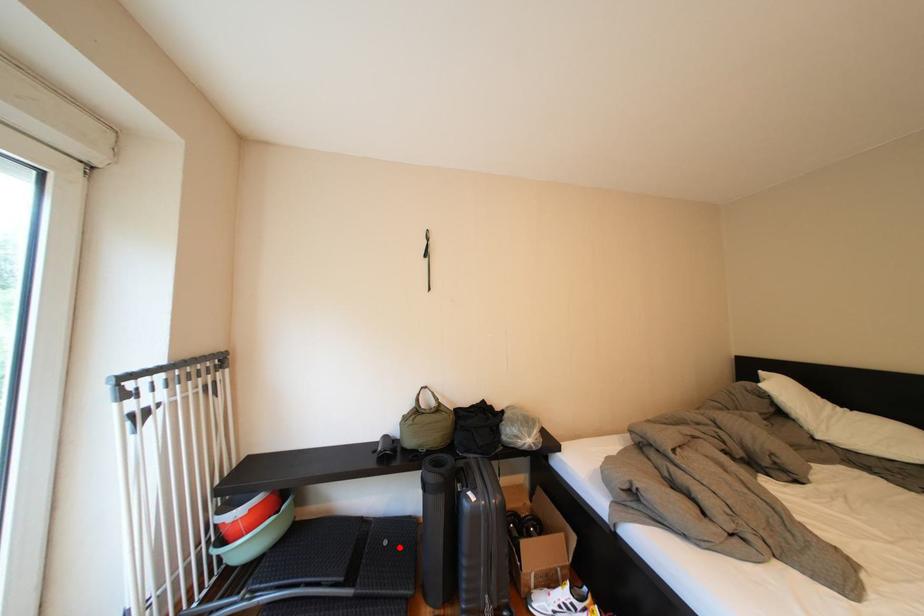
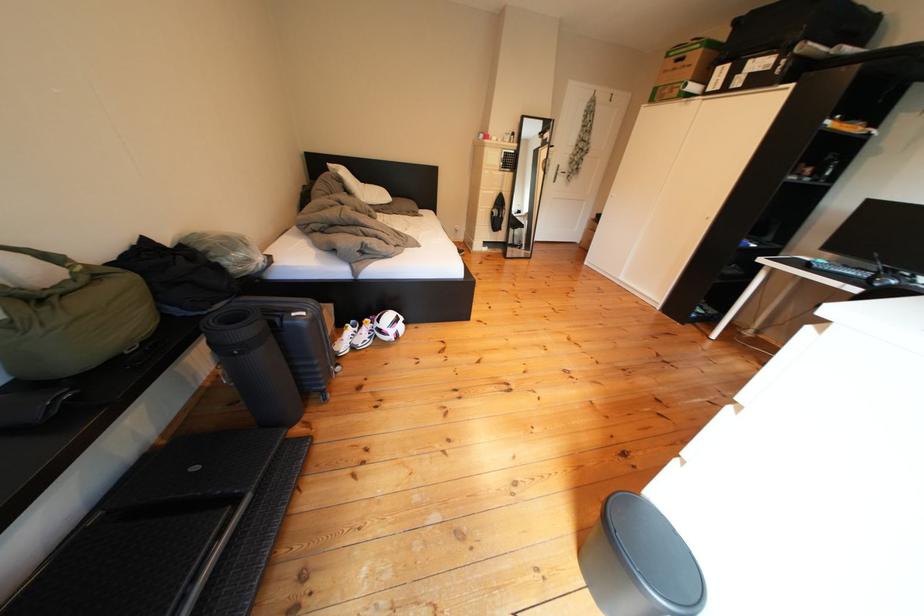
Question: I am providing you with two images of the same scene from different viewpoints. In image1, a red point is highlighted. Considering the same 3D point in image2, which of the following is correct?

Choices:
 (A) It is closer
 (B) It is farther

Answer: (B)